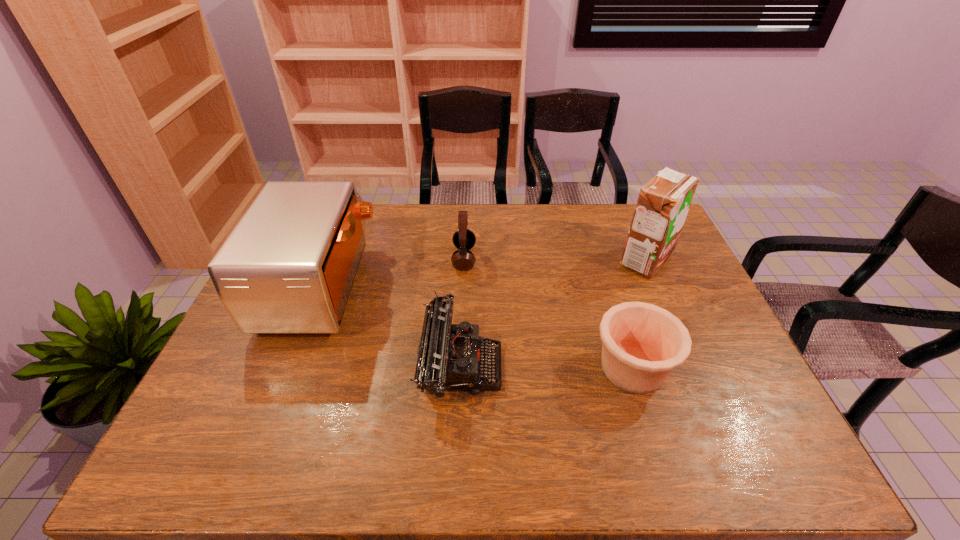
At what (x,y) coordinates should I click in order to perform the action: click on free space at the left edge. Please return your answer as a coordinate pair (x, y). The height and width of the screenshot is (540, 960). Looking at the image, I should click on (233, 397).

In the image, there is a desktop. Where is `vacant space at the right edge`? The width and height of the screenshot is (960, 540). vacant space at the right edge is located at coordinates tap(708, 353).

The image size is (960, 540). I want to click on free spot at the near left corner of the desktop, so click(x=195, y=459).

What are the coordinates of `free space between the typewriter and the pottery` in the screenshot? It's located at (546, 367).

What are the coordinates of `free spot between the pottery and the typewriter` in the screenshot? It's located at (546, 367).

This screenshot has width=960, height=540. I want to click on free space that is in between the headset and the typewriter, so click(463, 312).

I want to click on vacant area that lies between the leftmost object and the typewriter, so click(x=391, y=326).

Image resolution: width=960 pixels, height=540 pixels. I want to click on unoccupied position between the pottery and the third shortest object, so click(548, 313).

This screenshot has height=540, width=960. Identify the location of vacant area that lies between the typewriter and the third tallest object. (463, 312).

The image size is (960, 540). I want to click on unoccupied position between the carton and the headset, so click(555, 259).